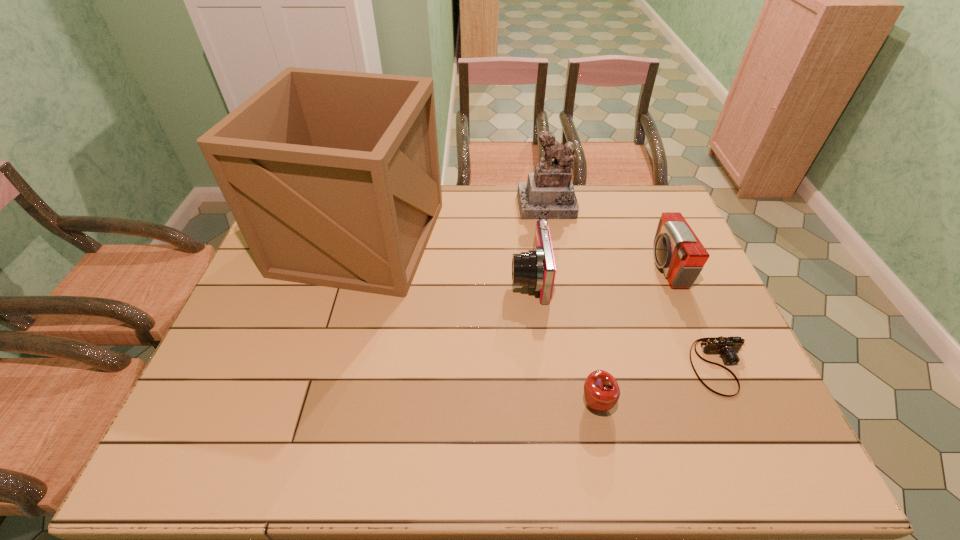
Image resolution: width=960 pixels, height=540 pixels. Find the location of `box`. box is located at coordinates click(333, 178).

The height and width of the screenshot is (540, 960). Identify the location of the leftmost object. (333, 178).

I want to click on figurine, so click(x=549, y=193).

At what (x,y) coordinates should I click in order to perform the action: click on the leftmost camera. Please return your answer as a coordinate pair (x, y). Looking at the image, I should click on coord(536,269).

Locate an element on the screen. This screenshot has width=960, height=540. apple is located at coordinates (601, 389).

Image resolution: width=960 pixels, height=540 pixels. Identify the location of the shortest camera. (728, 347).

Where is `the shortest object`? Image resolution: width=960 pixels, height=540 pixels. the shortest object is located at coordinates (728, 347).

Identify the location of blank space located on the front of the tallest object. The height and width of the screenshot is (540, 960). (339, 314).

Locate an element on the screen. This screenshot has width=960, height=540. free spot located 0.060m on the front-facing side of the second tallest object is located at coordinates (552, 231).

At what (x,y) coordinates should I click in order to perform the action: click on free point located 0.240m on the front-facing side of the leftmost camera. Please return your answer as a coordinate pair (x, y). This screenshot has height=540, width=960. Looking at the image, I should click on (431, 278).